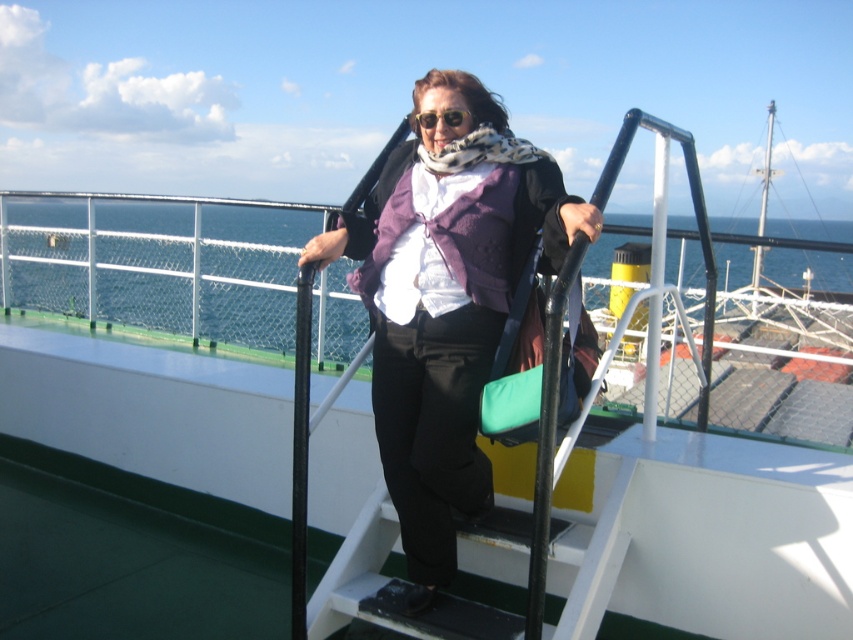
You are a photographer trying to capture a closeup of the purple woolen vest at center from your current position. Considering the vest is 6.80 feet away, can you get a clear shot without moving closer?

The purple woolen vest at center is 6.80 feet away from the viewer, so yes, you can get a clear closeup shot without moving closer as this distance is suitable for photography.

You are a photographer trying to capture a photo of the ship from the deck. You notice two points marked on your camera screen. The first point is at coordinates point (x=433, y=380) and the second point is at coordinates point (x=115, y=276). Which point is closer to your camera lens?

Point (x=433, y=380) is closer to the camera than point (x=115, y=276) according to the description.

You are a passenger on the ferry and want to take a photo of the blue water at upper center without the matte black sunglasses at center blocking the view. Is the sunglasses in a position that might obstruct the shot?

Result: The blue water at upper center is above the matte black sunglasses at center, so the sunglasses are below the water in the frame and would not obstruct the view of the blue water at upper center.